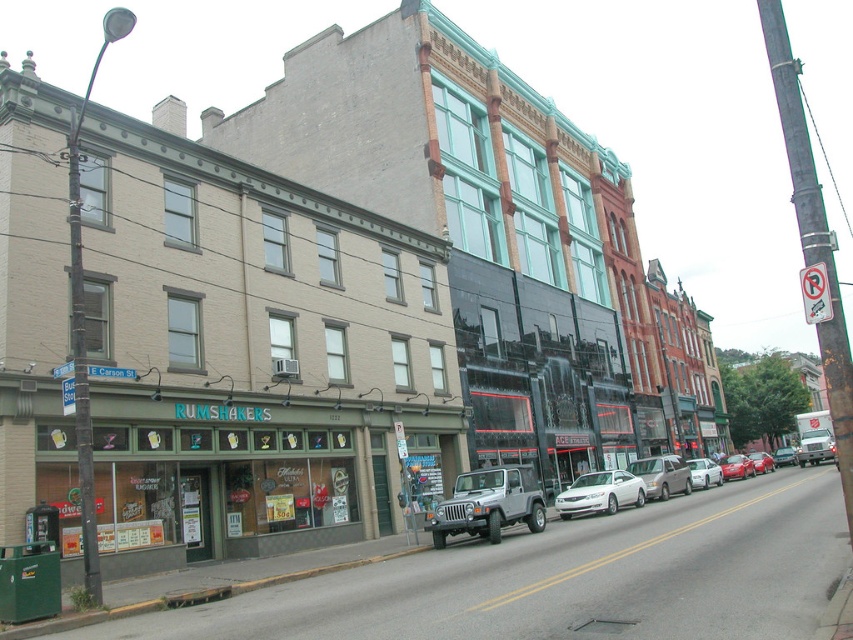
Question: Which of these objects is positioned farthest from the matte silver sedan at center?

Choices:
 (A) metallic red sedan at center
 (B) metallic red sedan at center-right

Answer: (B)

Question: Does white glossy sedan at center have a larger size compared to matte silver sedan at center?

Choices:
 (A) no
 (B) yes

Answer: (A)

Question: Can you confirm if white matte sedan at center is positioned to the right of matte silver sedan at center?

Choices:
 (A) no
 (B) yes

Answer: (A)

Question: Which object is positioned closest to the silver metallic van at center?

Choices:
 (A) white matte sedan at center
 (B) metallic red sedan at center
 (C) metallic red sedan at center-right
 (D) matte silver sedan at center

Answer: (A)

Question: Can you confirm if silver metallic van at center is wider than white matte sedan at center?

Choices:
 (A) yes
 (B) no

Answer: (B)

Question: Which of the following is the closest to the observer?

Choices:
 (A) white glossy sedan at center
 (B) metallic red sedan at center-right
 (C) matte silver sedan at center

Answer: (A)